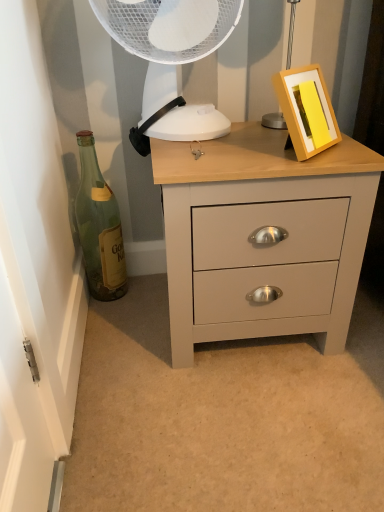
Question: Considering the relative sizes of green glass bottle at left and matte gray chest of drawers at center in the image provided, is green glass bottle at left bigger than matte gray chest of drawers at center?

Choices:
 (A) no
 (B) yes

Answer: (A)

Question: Is matte gray chest of drawers at center inside green glass bottle at left?

Choices:
 (A) yes
 (B) no

Answer: (B)

Question: Is green glass bottle at left to the left of matte gray chest of drawers at center from the viewer's perspective?

Choices:
 (A) no
 (B) yes

Answer: (B)

Question: Does green glass bottle at left appear on the right side of matte gray chest of drawers at center?

Choices:
 (A) yes
 (B) no

Answer: (B)

Question: Considering the relative sizes of green glass bottle at left and matte gray chest of drawers at center in the image provided, is green glass bottle at left smaller than matte gray chest of drawers at center?

Choices:
 (A) yes
 (B) no

Answer: (A)

Question: From a real-world perspective, does green glass bottle at left stand above matte gray chest of drawers at center?

Choices:
 (A) no
 (B) yes

Answer: (B)

Question: Does green glass bottle at left have a lesser height compared to white plastic mechanical fan at upper center?

Choices:
 (A) yes
 (B) no

Answer: (B)

Question: Is green glass bottle at left beside white plastic mechanical fan at upper center?

Choices:
 (A) no
 (B) yes

Answer: (A)

Question: Would you say green glass bottle at left is a long distance from white plastic mechanical fan at upper center?

Choices:
 (A) no
 (B) yes

Answer: (A)

Question: Is green glass bottle at left positioned with its back to white plastic mechanical fan at upper center?

Choices:
 (A) no
 (B) yes

Answer: (A)

Question: From a real-world perspective, is green glass bottle at left beneath white plastic mechanical fan at upper center?

Choices:
 (A) yes
 (B) no

Answer: (A)

Question: Does green glass bottle at left appear on the right side of white plastic mechanical fan at upper center?

Choices:
 (A) yes
 (B) no

Answer: (B)

Question: Is matte gray chest of drawers at center wider than white plastic mechanical fan at upper center?

Choices:
 (A) no
 (B) yes

Answer: (B)